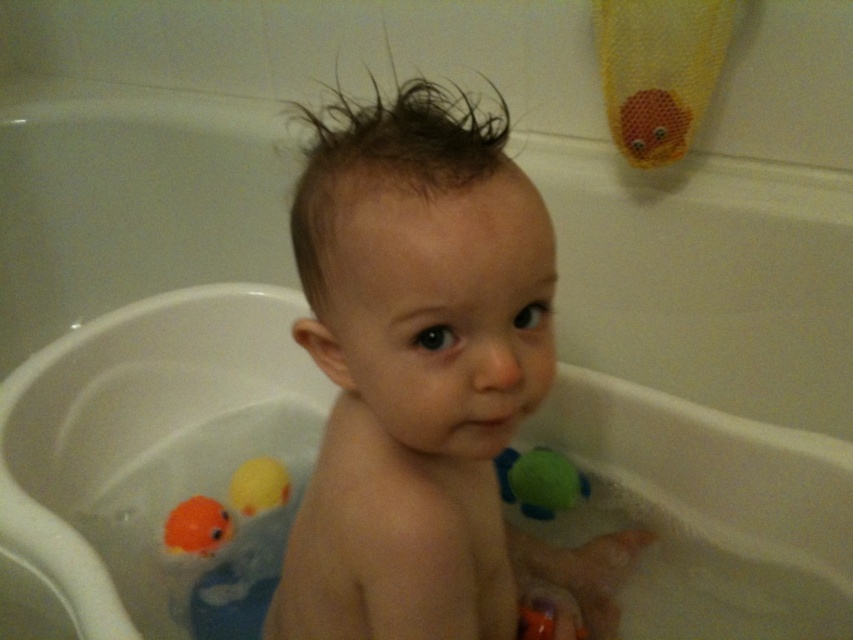
You are a parent trying to locate the green rubber ball at right in the baby bath. According to the coordinates provided, where exactly should you look in the image?

The green rubber ball at right is located at point [538,481] in the image.

You are a photographer taking a picture of the bathtub scene. You notice two points marked in the image at coordinates point (502, 497) and point (178, 552). Which point should you focus on first if you want to ensure both points are in focus?

You should focus on point (502, 497) first because it is closer to the camera than point (178, 552), ensuring both points will be in focus when focusing on the closer one.

You are a parent trying to reach a toy that fell into the bathtub. The toy is located at point (x=352, y=525). If your hand can reach up to 50 centimeters, will you be able to grab it?

The distance between point (x=352, y=525) and the camera is 51.47 centimeters. Since your hand can only reach up to 50 centimeters, you won not be able to grab the toy at point (x=352, y=525).